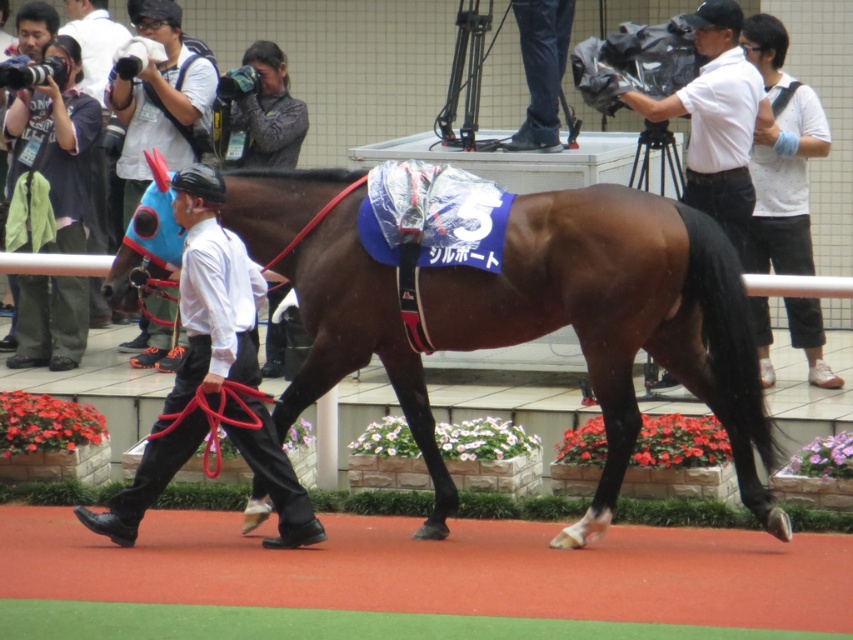
Question: Does brown glossy horse at center appear on the right side of blue fabric helmet at left?

Choices:
 (A) yes
 (B) no

Answer: (A)

Question: Which object is farther from the camera taking this photo?

Choices:
 (A) matte black camera at left
 (B) brown glossy horse at center

Answer: (A)

Question: Considering the real-world distances, which object is farthest from the white smooth shirt at upper right?

Choices:
 (A) blue fabric helmet at left
 (B) brown glossy horse at center
 (C) matte black camera at left
 (D) matte black helmet at upper left

Answer: (D)

Question: Does white shirt at center appear under blue fabric helmet at left?

Choices:
 (A) no
 (B) yes

Answer: (B)

Question: Which of these objects is positioned farthest from the matte black camera at left?

Choices:
 (A) blue fabric helmet at left
 (B) brown glossy horse at center
 (C) white dotted shirt at upper right
 (D) matte black helmet at upper left

Answer: (C)

Question: Can you confirm if white smooth shirt at upper right is positioned to the right of blue fabric helmet at left?

Choices:
 (A) yes
 (B) no

Answer: (A)